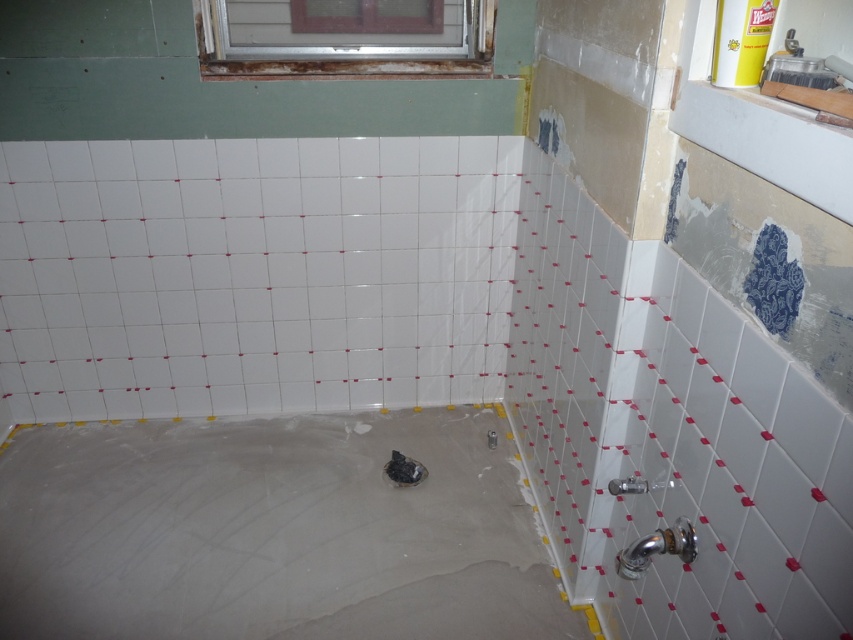
You are a contractor measuring the bathroom for safety regulations. The safety code requires that the smooth concrete bathtub at lower left must be at least 1.5 meters away from the metallic silver window at upper center to prevent condensation damage. Does the current placement meet the requirement?

The distance between the smooth concrete bathtub at lower left and the metallic silver window at upper center is 1.54 meters, which exceeds the required 1.5 meters. Therefore, the placement meets the safety requirement.

You are a contractor measuring the bathroom for new fixtures. You need to install a new shower curtain rod that must be 1.2 meters wide. The rod will be placed above the smooth concrete bathtub at lower left. Can the space between the bathtub and the metallic silver window at upper center accommodate the rod?

The smooth concrete bathtub at lower left might be wider than metallic silver window at upper center, so it is uncertain if the space between them can accommodate the 1.2 meter shower curtain rod. Further measurements are needed to confirm.